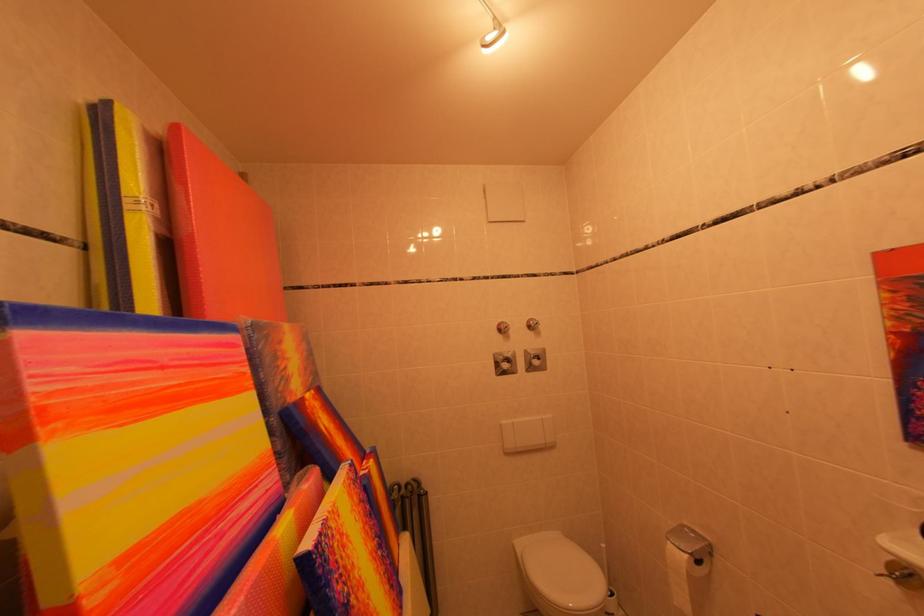
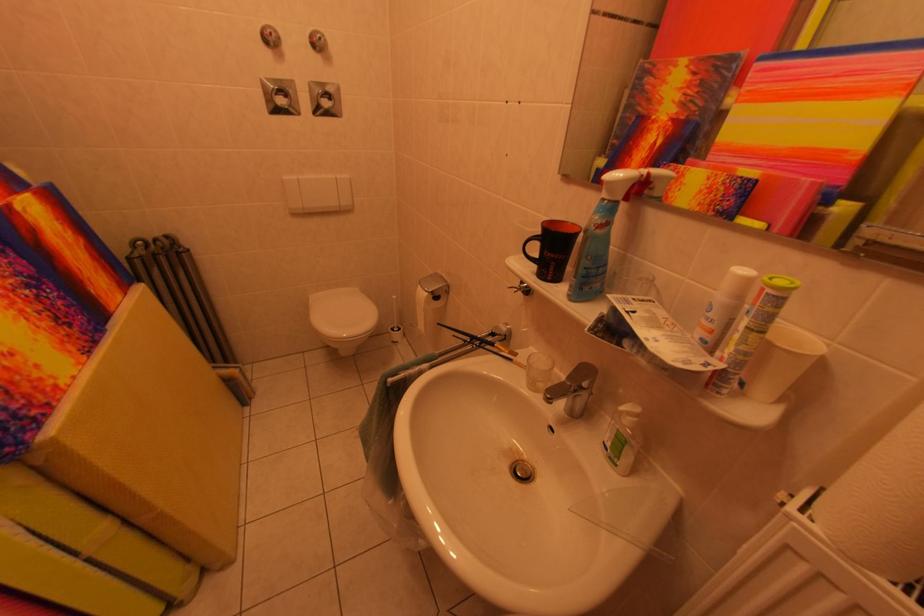
Locate, in the second image, the point that corresponds to (x=528, y=548) in the first image.

(322, 301)